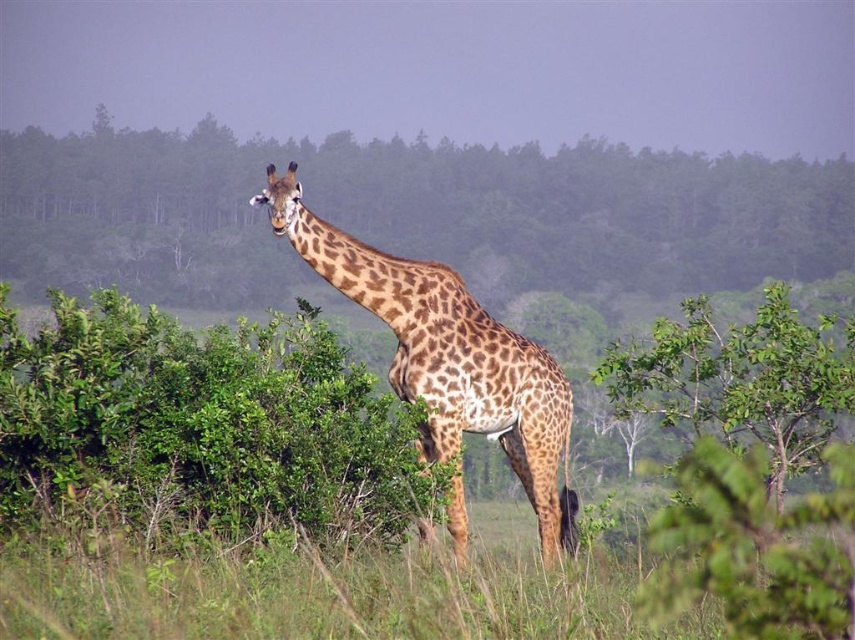
Question: Does green leafy tree at center come in front of spotted fur giraffe at center?

Choices:
 (A) yes
 (B) no

Answer: (B)

Question: Considering the real-world distances, which object is farthest from the spotted fur giraffe at center?

Choices:
 (A) green leafy tree at center
 (B) green leafy bush at center

Answer: (A)

Question: Which object appears closest to the camera in this image?

Choices:
 (A) green leafy tree at center
 (B) green leafy bush at center
 (C) spotted fur giraffe at center

Answer: (B)

Question: Can you confirm if green leafy bush at center is positioned above spotted fur giraffe at center?

Choices:
 (A) no
 (B) yes

Answer: (A)

Question: Which object is the closest to the green leafy tree at center?

Choices:
 (A) spotted fur giraffe at center
 (B) green leafy bush at center

Answer: (A)

Question: Can you confirm if green leafy tree at center is thinner than green leafy bush at center?

Choices:
 (A) yes
 (B) no

Answer: (B)